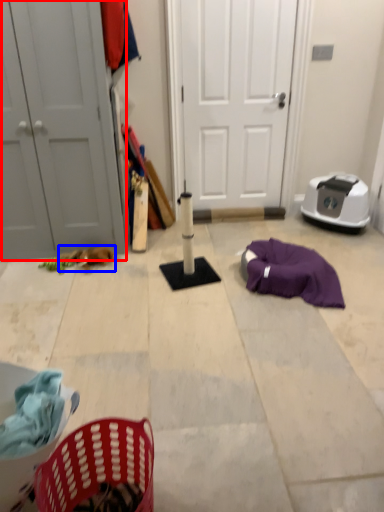
Question: Which point is closer to the camera, door (highlighted by a red box) or animal (highlighted by a blue box)?

Choices:
 (A) door
 (B) animal

Answer: (A)